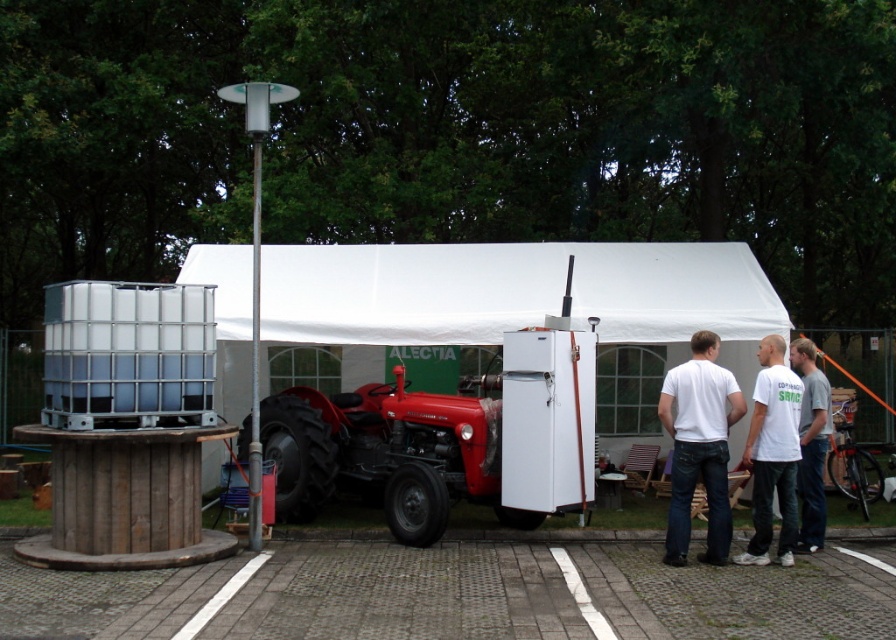
Question: Is red metal tractor at center positioned at the back of white cotton t-shirt at center?

Choices:
 (A) yes
 (B) no

Answer: (A)

Question: Which point is farther from the camera taking this photo?

Choices:
 (A) (713, 444)
 (B) (799, 476)

Answer: (B)

Question: Is white matte t-shirt at center to the right of white cotton t-shirt at center from the viewer's perspective?

Choices:
 (A) no
 (B) yes

Answer: (A)

Question: Based on their relative distances, which object is farther from the white fabric tent at center?

Choices:
 (A) white cotton t-shirt at lower right
 (B) red metal tractor at center

Answer: (A)

Question: Which of the following is the closest to the observer?

Choices:
 (A) white matte t-shirt at center
 (B) white cotton t-shirt at lower right

Answer: (A)

Question: Is white fabric tent at center above white matte t-shirt at center?

Choices:
 (A) no
 (B) yes

Answer: (B)